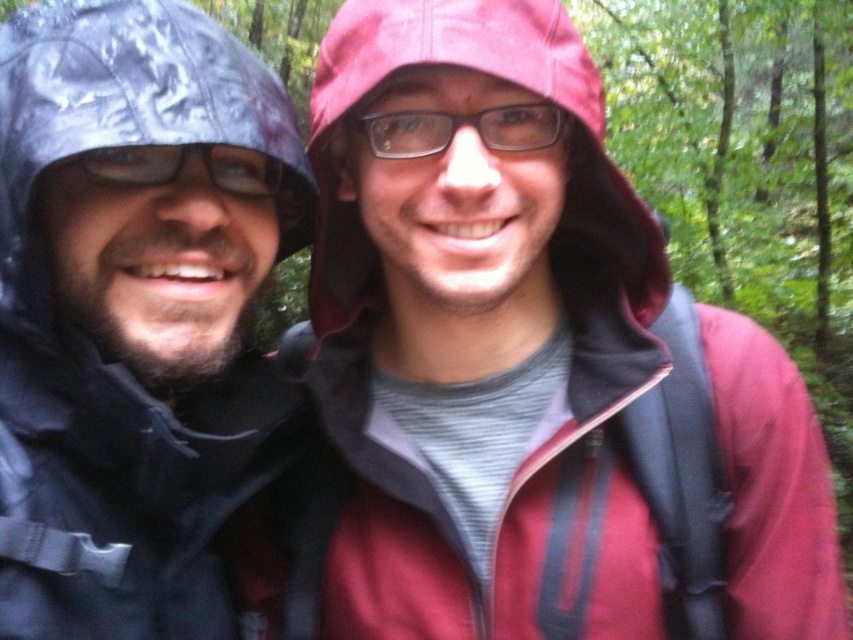
You are a photographer trying to capture both the matte black jacket at left and the clear plastic glasses at center in a single frame. Given that the camera can only focus on objects within a 1.5 meter width, will both items fit within the frame?

The matte black jacket at left is wider than the clear plastic glasses at center. Since the camera can focus on objects within a 1.5 meter width, both items can fit in the frame as long as their combined width does not exceed 1.5 meters. However, the exact fit depends on their individual widths and positioning.

In the scene shown: You are a photographer trying to capture a candid shot of the hikers. You notice the matte black jacket at left and the clear plastic glasses at center. Based on their positions, which object would be easier to focus on if you aim your camera at the glasses?

The matte black jacket at left is located below clear plastic glasses at center, so focusing on the clear plastic glasses at center would be easier since they are closer to the camera.

You are a photographer trying to capture a candid shot of the two hikers. You want to ensure that the matte black jacket at left and the clear plastic glasses at center are both in the frame. Based on their positions, which object should you focus on first to include both in your shot?

The matte black jacket at left is to the left of clear plastic glasses at center, so focusing on the matte black jacket at left first would ensure both are included in the frame since it is positioned to the left of the glasses.